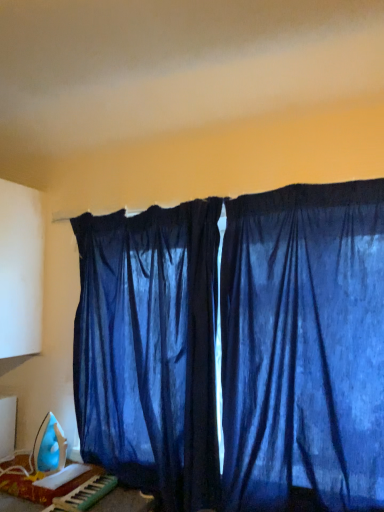
Question: Does blue sheer curtains at center, which is the 1th curtain in right-to-left order, have a smaller size compared to satin blue curtain at center, the second curtain when ordered from right to left?

Choices:
 (A) yes
 (B) no

Answer: (A)

Question: Are blue sheer curtains at center, the second curtain viewed from the left, and satin blue curtain at center, the second curtain when ordered from right to left, far apart?

Choices:
 (A) yes
 (B) no

Answer: (B)

Question: Considering the relative positions of blue sheer curtains at center, which is the 1th curtain in right-to-left order, and satin blue curtain at center, which is counted as the 1th curtain, starting from the left, in the image provided, is blue sheer curtains at center, which is the 1th curtain in right-to-left order, to the left of satin blue curtain at center, which is counted as the 1th curtain, starting from the left, from the viewer's perspective?

Choices:
 (A) yes
 (B) no

Answer: (B)

Question: Does blue sheer curtains at center, the second curtain viewed from the left, come behind satin blue curtain at center, the second curtain when ordered from right to left?

Choices:
 (A) no
 (B) yes

Answer: (A)

Question: From the image's perspective, is blue sheer curtains at center, which is the 1th curtain in right-to-left order, on satin blue curtain at center, which is counted as the 1th curtain, starting from the left?

Choices:
 (A) yes
 (B) no

Answer: (A)

Question: From a real-world perspective, is plastic green and white musical keyboard at lower left positioned above or below satin blue curtain at center, the second curtain when ordered from right to left?

Choices:
 (A) below
 (B) above

Answer: (A)

Question: Looking at the image, does plastic green and white musical keyboard at lower left seem bigger or smaller compared to satin blue curtain at center, which is counted as the 1th curtain, starting from the left?

Choices:
 (A) big
 (B) small

Answer: (B)

Question: Is plastic green and white musical keyboard at lower left in front of or behind satin blue curtain at center, the second curtain when ordered from right to left, in the image?

Choices:
 (A) behind
 (B) front

Answer: (B)

Question: From the image's perspective, is plastic green and white musical keyboard at lower left located above or below satin blue curtain at center, which is counted as the 1th curtain, starting from the left?

Choices:
 (A) above
 (B) below

Answer: (B)

Question: Is blue sheer curtains at center, the second curtain viewed from the left, inside the boundaries of plastic green and white musical keyboard at lower left, or outside?

Choices:
 (A) inside
 (B) outside

Answer: (B)

Question: From the image's perspective, is blue sheer curtains at center, which is the 1th curtain in right-to-left order, located above or below plastic green and white musical keyboard at lower left?

Choices:
 (A) below
 (B) above

Answer: (B)

Question: From a real-world perspective, is blue sheer curtains at center, which is the 1th curtain in right-to-left order, positioned above or below plastic green and white musical keyboard at lower left?

Choices:
 (A) above
 (B) below

Answer: (A)

Question: From their relative heights in the image, would you say blue sheer curtains at center, which is the 1th curtain in right-to-left order, is taller or shorter than plastic green and white musical keyboard at lower left?

Choices:
 (A) tall
 (B) short

Answer: (A)

Question: Does point (44, 482) appear closer or farther from the camera than point (51, 506)?

Choices:
 (A) closer
 (B) farther

Answer: (B)

Question: Based on their positions, is blue plastic iron at lower left located to the left or right of plastic green and white musical keyboard at lower left?

Choices:
 (A) right
 (B) left

Answer: (B)